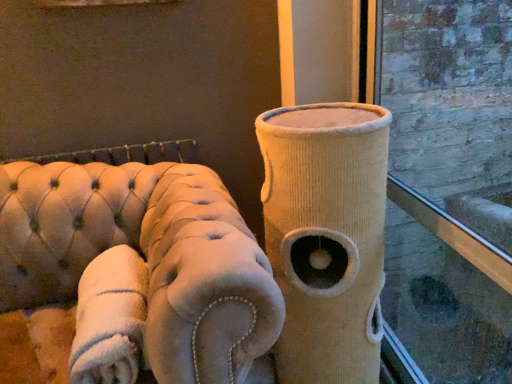
Question: From the image's perspective, would you say beige corduroy cat tower at center is positioned over beige tufted sofa at left?

Choices:
 (A) no
 (B) yes

Answer: (B)

Question: From a real-world perspective, is beige corduroy cat tower at center physically below beige tufted sofa at left?

Choices:
 (A) yes
 (B) no

Answer: (B)

Question: Is beige corduroy cat tower at center positioned in front of beige tufted sofa at left?

Choices:
 (A) yes
 (B) no

Answer: (B)

Question: Considering the relative sizes of beige corduroy cat tower at center and beige tufted sofa at left in the image provided, is beige corduroy cat tower at center wider than beige tufted sofa at left?

Choices:
 (A) yes
 (B) no

Answer: (B)

Question: From a real-world perspective, is beige corduroy cat tower at center on beige tufted sofa at left?

Choices:
 (A) no
 (B) yes

Answer: (B)

Question: Considering the relative sizes of beige corduroy cat tower at center and beige tufted sofa at left in the image provided, is beige corduroy cat tower at center shorter than beige tufted sofa at left?

Choices:
 (A) yes
 (B) no

Answer: (B)

Question: Is beige tufted sofa at left facing away from white plush blanket at lower left?

Choices:
 (A) yes
 (B) no

Answer: (A)

Question: Could you tell me if beige tufted sofa at left is facing white plush blanket at lower left?

Choices:
 (A) yes
 (B) no

Answer: (A)

Question: Is beige tufted sofa at left to the right of white plush blanket at lower left from the viewer's perspective?

Choices:
 (A) no
 (B) yes

Answer: (A)

Question: Can you confirm if beige tufted sofa at left is smaller than white plush blanket at lower left?

Choices:
 (A) no
 (B) yes

Answer: (A)

Question: Are beige tufted sofa at left and white plush blanket at lower left making contact?

Choices:
 (A) no
 (B) yes

Answer: (B)

Question: Does beige tufted sofa at left have a lesser width compared to white plush blanket at lower left?

Choices:
 (A) no
 (B) yes

Answer: (A)

Question: Can you confirm if beige tufted sofa at left is thinner than beige corduroy cat tower at center?

Choices:
 (A) yes
 (B) no

Answer: (B)